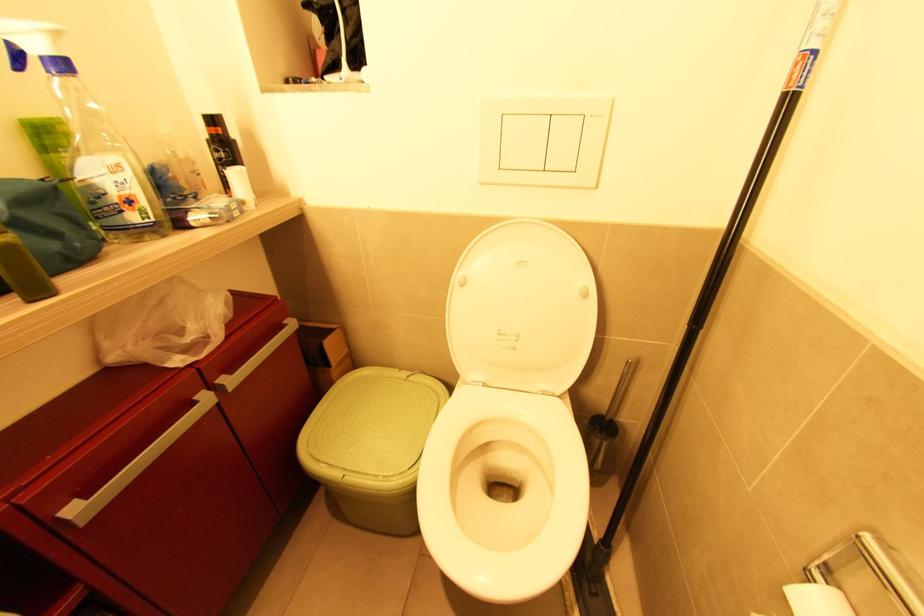
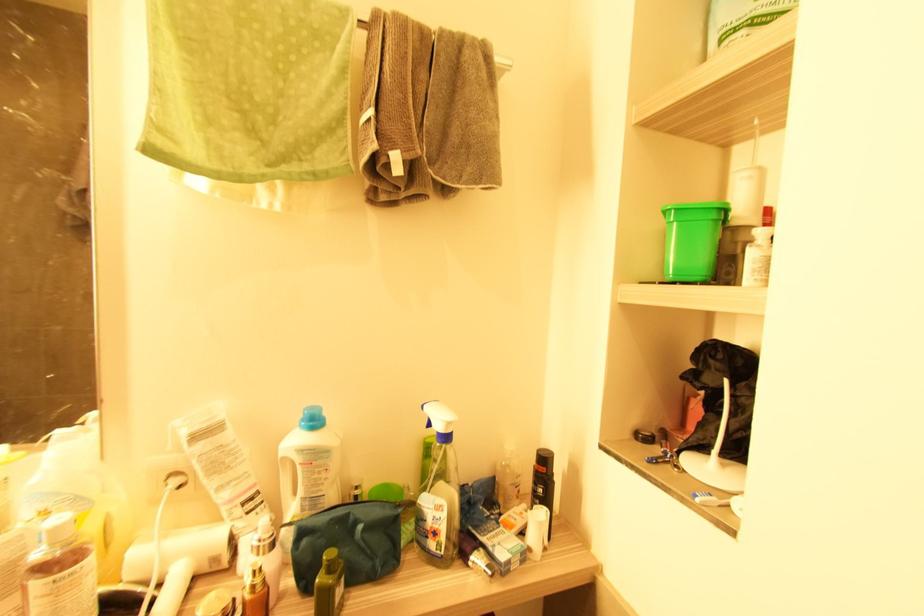
Find the pixel in the second image that matches [124,213] in the first image.

(429, 539)